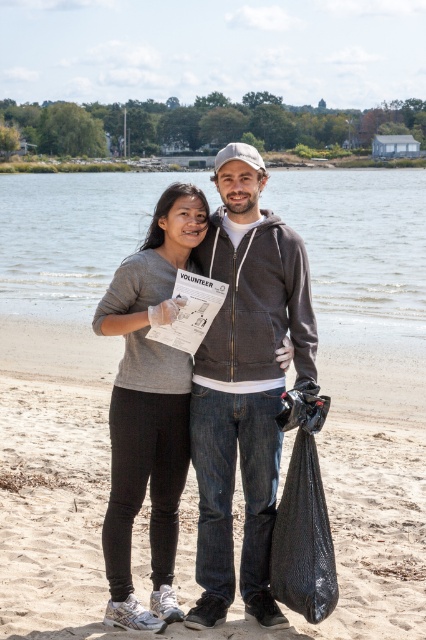
You are a photographer trying to capture a closeup of the dark gray hoodie at center and the black plastic bag at lower right. Which object should you zoom in on to ensure both are in focus without moving the camera?

You should zoom in on the dark gray hoodie at center because it is larger than the black plastic bag at lower right, so focusing on the larger object will keep both in focus.

You are a volunteer on the beach and need to place a new recycling bin. The recycling bin must be placed to the right of the clear water at center and to the left of the black plastic bag at lower right. Is this possible?

The clear water at center is positioned on the left side of black plastic bag at lower right. Therefore, placing the recycling bin to the right of the clear water at center and to the left of the black plastic bag at lower right is possible since there is space between them.

You are organizing a beach cleanup and need to decide which item to store first. Since the matte gray sweatshirt at center is larger than the black plastic bag at lower right, which item should you place in the storage container first to maximize space efficiency?

The black plastic bag at lower right should be placed first in the storage container because it is smaller, allowing the larger matte gray sweatshirt at center to be placed over it, optimizing space usage.